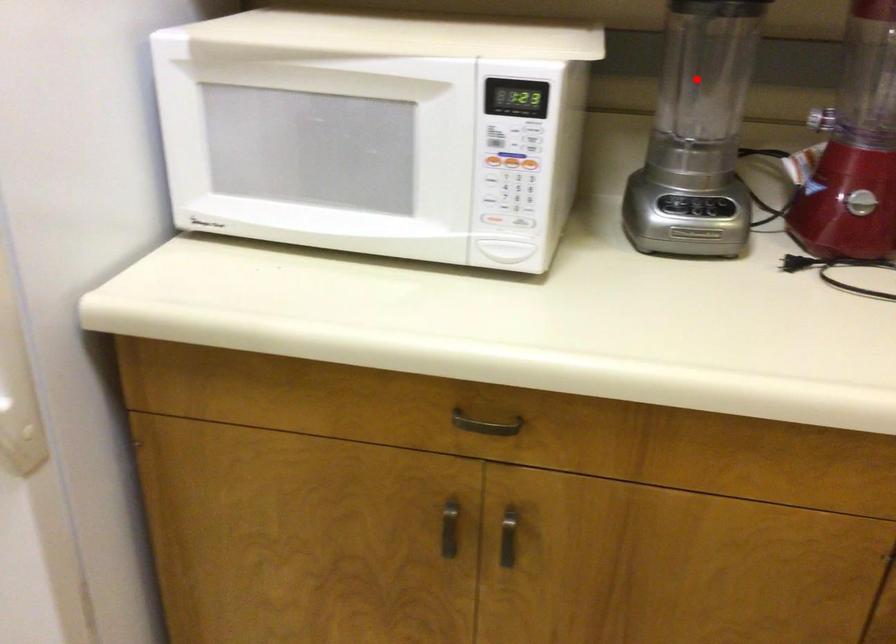
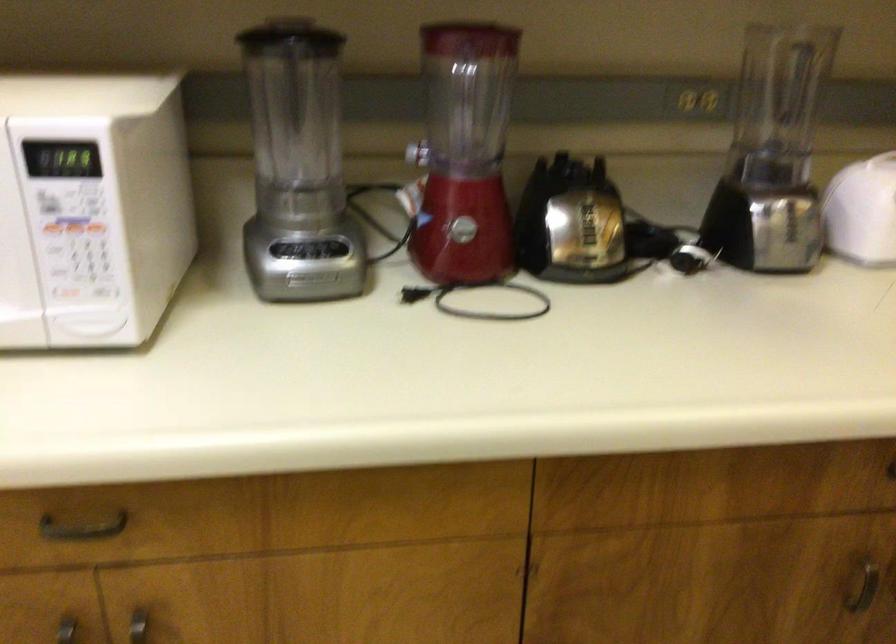
The point at the highlighted location is marked in the first image. Where is the corresponding point in the second image?

(295, 120)